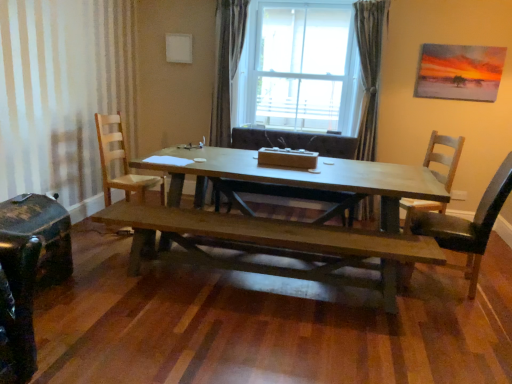
Find the location of `free space in front of light brown wooden chair at left, acting as the 1th chair starting from the left`. free space in front of light brown wooden chair at left, acting as the 1th chair starting from the left is located at coordinates (100, 243).